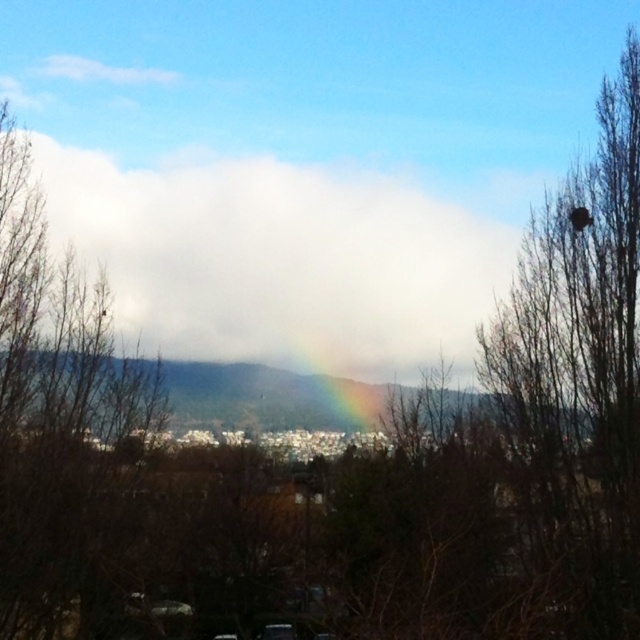
Measure the distance between white fluffy cloud at center and rainbow at center.

white fluffy cloud at center is 8.46 feet from rainbow at center.

Between white fluffy cloud at center and rainbow at center, which one has more height?

white fluffy cloud at center is taller.

Is point (148, 202) positioned behind point (348, 388)?

Yes, point (148, 202) is farther from viewer.

Where is `white fluffy cloud at center`? Image resolution: width=640 pixels, height=640 pixels. white fluffy cloud at center is located at coordinates point(280,259).

Does white fluffy cloud at center come behind brown textured bird nest at upper right?

Yes, white fluffy cloud at center is further from the viewer.

Looking at this image, measure the distance between point (x=88, y=188) and camera.

Point (x=88, y=188) and camera are 29.22 meters apart from each other.

Locate an element on the screen. The height and width of the screenshot is (640, 640). white fluffy cloud at center is located at coordinates (280, 259).

The width and height of the screenshot is (640, 640). I want to click on white fluffy cloud at center, so click(x=280, y=259).

Is brown textured bird nest at upper right wider than brown leafless tree at left?

No.

Who is positioned more to the left, brown textured bird nest at upper right or brown leafless tree at left?

From the viewer's perspective, brown leafless tree at left appears more on the left side.

The width and height of the screenshot is (640, 640). I want to click on brown textured bird nest at upper right, so click(577, 385).